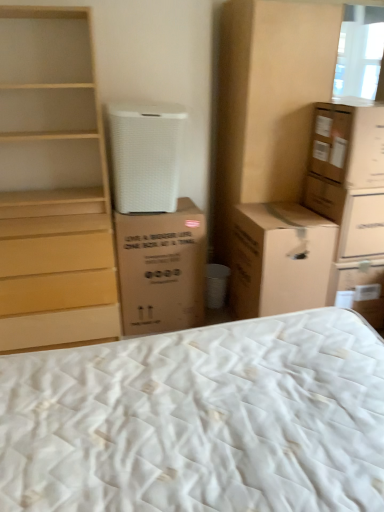
Find the location of a particular element. brown cardboard box at center, the 4th cardboard box from the right is located at coordinates pyautogui.click(x=161, y=269).

What is the approximate height of brown cardboard box at right, which is counted as the 1th cardboard box, starting from the right?

It is 16.88 inches.

The height and width of the screenshot is (512, 384). Describe the element at coordinates (348, 144) in the screenshot. I see `brown cardboard box at upper right, the 3th cardboard box when ordered from left to right` at that location.

Image resolution: width=384 pixels, height=512 pixels. Describe the element at coordinates (53, 185) in the screenshot. I see `light wood chest of drawers at left` at that location.

Find the location of `brown cardboard box at upper right, marked as the third cardboard box in a right-to-left arrangement`. brown cardboard box at upper right, marked as the third cardboard box in a right-to-left arrangement is located at coordinates (279, 259).

Image resolution: width=384 pixels, height=512 pixels. What do you see at coordinates (145, 155) in the screenshot?
I see `white matte air purifier at upper center` at bounding box center [145, 155].

Image resolution: width=384 pixels, height=512 pixels. I want to click on brown cardboard box at center, which is the 1th cardboard box in left-to-right order, so click(161, 269).

Which is closer, [280,158] or [172,203]?

Point [280,158] is farther from the camera than point [172,203].

Consider the image. Which is more to the left, brown cardboard cabinet at upper right or white matte air purifier at upper center?

white matte air purifier at upper center.

Between brown cardboard cabinet at upper right and white matte air purifier at upper center, which one is positioned behind?

brown cardboard cabinet at upper right is behind.

Can you confirm if brown cardboard cabinet at upper right is taller than white matte air purifier at upper center?

Correct, brown cardboard cabinet at upper right is much taller as white matte air purifier at upper center.

Are white quilted mattress at lower center and brown cardboard box at upper right, the 2th cardboard box positioned from the left, beside each other?

No, white quilted mattress at lower center is not making contact with brown cardboard box at upper right, the 2th cardboard box positioned from the left.

Identify the location of the 1st cardboard box counting from the right side of the white quilted mattress at lower center. This screenshot has width=384, height=512. (279, 259).

Between white quilted mattress at lower center and brown cardboard box at upper right, marked as the third cardboard box in a right-to-left arrangement, which one has larger width?

Wider between the two is white quilted mattress at lower center.

Is brown cardboard box at upper right, positioned as the second cardboard box in right-to-left order, aimed at brown cardboard box at center, which is the 1th cardboard box in left-to-right order?

No, brown cardboard box at upper right, positioned as the second cardboard box in right-to-left order, is not turned towards brown cardboard box at center, which is the 1th cardboard box in left-to-right order.

From the image's perspective, which object appears higher, brown cardboard box at upper right, positioned as the second cardboard box in right-to-left order, or brown cardboard box at center, the 4th cardboard box from the right?

brown cardboard box at upper right, positioned as the second cardboard box in right-to-left order.

Which point is more distant from viewer, [342,165] or [163,268]?

The point [163,268] is farther.

From a real-world perspective, is brown cardboard box at upper right, the 3th cardboard box when ordered from left to right, physically located above or below brown cardboard box at center, the 4th cardboard box from the right?

brown cardboard box at upper right, the 3th cardboard box when ordered from left to right, is situated higher than brown cardboard box at center, the 4th cardboard box from the right, in the real world.

Can you confirm if brown cardboard cabinet at upper right is shorter than brown cardboard box at right, which is the fourth cardboard box in left-to-right order?

No, brown cardboard cabinet at upper right is not shorter than brown cardboard box at right, which is the fourth cardboard box in left-to-right order.

Which object is more forward, brown cardboard cabinet at upper right or brown cardboard box at right, which is counted as the 1th cardboard box, starting from the right?

brown cardboard cabinet at upper right is closer to the camera.

Is brown cardboard cabinet at upper right not near brown cardboard box at right, which is the fourth cardboard box in left-to-right order?

No, brown cardboard cabinet at upper right is in close proximity to brown cardboard box at right, which is the fourth cardboard box in left-to-right order.

From the picture: Can you confirm if light wood chest of drawers at left is positioned to the right of brown cardboard box at upper right, the 3th cardboard box when ordered from left to right?

No.

Are light wood chest of drawers at left and brown cardboard box at upper right, positioned as the second cardboard box in right-to-left order, located far from each other?

Yes, light wood chest of drawers at left and brown cardboard box at upper right, positioned as the second cardboard box in right-to-left order, are located far from each other.

Where is `chest of drawers on the left of brown cardboard box at upper right, positioned as the second cardboard box in right-to-left order`? chest of drawers on the left of brown cardboard box at upper right, positioned as the second cardboard box in right-to-left order is located at coordinates (53, 185).

Is light wood chest of drawers at left smaller than brown cardboard box at upper right, the 3th cardboard box when ordered from left to right?

Actually, light wood chest of drawers at left might be larger than brown cardboard box at upper right, the 3th cardboard box when ordered from left to right.

Can brown cardboard box at upper right, positioned as the second cardboard box in right-to-left order, be found inside brown cardboard cabinet at upper right?

No, brown cardboard box at upper right, positioned as the second cardboard box in right-to-left order, is located outside of brown cardboard cabinet at upper right.

Considering the relative sizes of brown cardboard cabinet at upper right and brown cardboard box at upper right, positioned as the second cardboard box in right-to-left order, in the image provided, is brown cardboard cabinet at upper right wider than brown cardboard box at upper right, positioned as the second cardboard box in right-to-left order,?

Correct, the width of brown cardboard cabinet at upper right exceeds that of brown cardboard box at upper right, positioned as the second cardboard box in right-to-left order.

In the scene shown: Can you confirm if brown cardboard cabinet at upper right is taller than brown cardboard box at upper right, positioned as the second cardboard box in right-to-left order?

Correct, brown cardboard cabinet at upper right is much taller as brown cardboard box at upper right, positioned as the second cardboard box in right-to-left order.

Is brown cardboard cabinet at upper right positioned with its back to brown cardboard box at upper right, positioned as the second cardboard box in right-to-left order?

Yes, brown cardboard cabinet at upper right is positioned with its back facing brown cardboard box at upper right, positioned as the second cardboard box in right-to-left order.

Locate an element on the screen. The image size is (384, 512). cardboard box that is the 1st object to the right of the white matte air purifier at upper center, starting at the anchor is located at coordinates pos(161,269).

Does white matte air purifier at upper center come in front of brown cardboard box at center, which is the 1th cardboard box in left-to-right order?

Yes, white matte air purifier at upper center is closer to the camera.

Could you measure the distance between white matte air purifier at upper center and brown cardboard box at center, which is the 1th cardboard box in left-to-right order?

white matte air purifier at upper center and brown cardboard box at center, which is the 1th cardboard box in left-to-right order, are 14.41 inches apart.

Considering the relative sizes of white matte air purifier at upper center and brown cardboard box at center, the 4th cardboard box from the right, in the image provided, is white matte air purifier at upper center taller than brown cardboard box at center, the 4th cardboard box from the right,?

In fact, white matte air purifier at upper center may be shorter than brown cardboard box at center, the 4th cardboard box from the right.

In the image, there is a brown cardboard cabinet at upper right. What are the coordinates of `appliance below it (from the image's perspective)` in the screenshot? It's located at (145, 155).

I want to click on bed that appears in front of the brown cardboard box at upper right, the 2th cardboard box positioned from the left, so click(x=200, y=420).

When comparing their distances from white quilted mattress at lower center, does light wood chest of drawers at left or brown cardboard box at upper right, marked as the third cardboard box in a right-to-left arrangement, seem closer?

brown cardboard box at upper right, marked as the third cardboard box in a right-to-left arrangement, is closer to white quilted mattress at lower center.

Looking at the image, which one is located closer to brown cardboard box at upper right, positioned as the second cardboard box in right-to-left order, white matte air purifier at upper center or light wood chest of drawers at left?

white matte air purifier at upper center is closer to brown cardboard box at upper right, positioned as the second cardboard box in right-to-left order.

Looking at the image, which one is located further to white quilted mattress at lower center, white matte air purifier at upper center or light wood chest of drawers at left?

light wood chest of drawers at left.

When comparing their distances from brown cardboard box at center, which is the 1th cardboard box in left-to-right order, does light wood chest of drawers at left or brown cardboard box at upper right, marked as the third cardboard box in a right-to-left arrangement, seem closer?

brown cardboard box at upper right, marked as the third cardboard box in a right-to-left arrangement.

When comparing their distances from brown cardboard box at upper right, the 3th cardboard box when ordered from left to right, does brown cardboard box at center, which is the 1th cardboard box in left-to-right order, or light wood chest of drawers at left seem closer?

Among the two, brown cardboard box at center, which is the 1th cardboard box in left-to-right order, is located nearer to brown cardboard box at upper right, the 3th cardboard box when ordered from left to right.

Estimate the real-world distances between objects in this image. Which object is further from brown cardboard box at right, which is counted as the 1th cardboard box, starting from the right, light wood chest of drawers at left or white matte air purifier at upper center?

Based on the image, light wood chest of drawers at left appears to be further to brown cardboard box at right, which is counted as the 1th cardboard box, starting from the right.

Based on their spatial positions, is brown cardboard box at upper right, the 3th cardboard box when ordered from left to right, or brown cardboard box at right, which is counted as the 1th cardboard box, starting from the right, further from white quilted mattress at lower center?

brown cardboard box at upper right, the 3th cardboard box when ordered from left to right, is positioned further to the anchor white quilted mattress at lower center.

When comparing their distances from white quilted mattress at lower center, does brown cardboard box at upper right, positioned as the second cardboard box in right-to-left order, or white matte air purifier at upper center seem closer?

The object closer to white quilted mattress at lower center is white matte air purifier at upper center.

This screenshot has width=384, height=512. Find the location of `cardboard box positioned between white quilted mattress at lower center and brown cardboard box at upper right, marked as the third cardboard box in a right-to-left arrangement, from near to far`. cardboard box positioned between white quilted mattress at lower center and brown cardboard box at upper right, marked as the third cardboard box in a right-to-left arrangement, from near to far is located at coordinates (348, 144).

This screenshot has height=512, width=384. I want to click on appliance between white quilted mattress at lower center and brown cardboard box at right, which is counted as the 1th cardboard box, starting from the right, from front to back, so click(x=145, y=155).

Image resolution: width=384 pixels, height=512 pixels. Find the location of `bed located between light wood chest of drawers at left and brown cardboard box at right, which is counted as the 1th cardboard box, starting from the right, in the left-right direction`. bed located between light wood chest of drawers at left and brown cardboard box at right, which is counted as the 1th cardboard box, starting from the right, in the left-right direction is located at coordinates (200, 420).

Identify the location of cabinetry located between light wood chest of drawers at left and brown cardboard box at right, which is the fourth cardboard box in left-to-right order, in the left-right direction. The height and width of the screenshot is (512, 384). (268, 101).